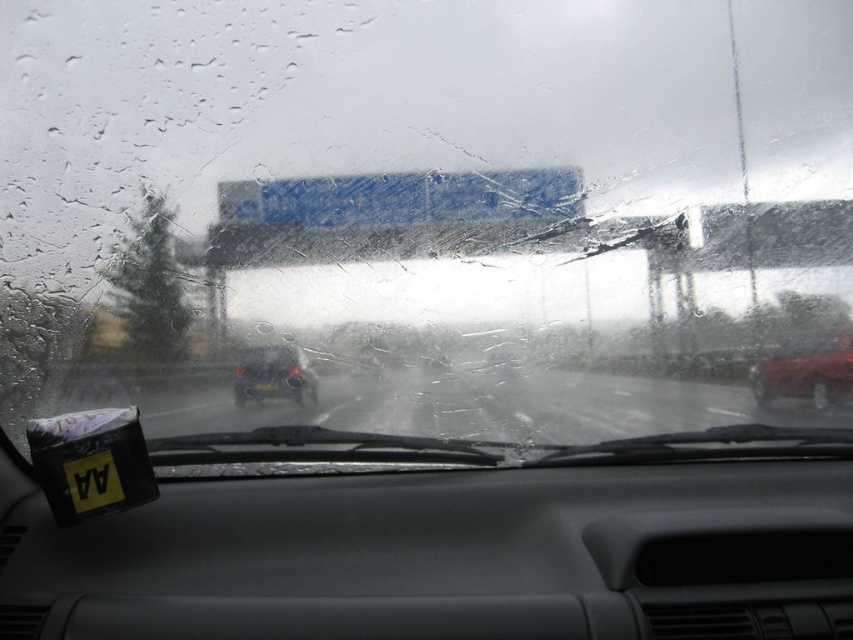
Can you confirm if black matte license plate at lower left is thinner than black plastic license plate at center?

In fact, black matte license plate at lower left might be wider than black plastic license plate at center.

Does black matte license plate at lower left come in front of black plastic license plate at center?

Yes, black matte license plate at lower left is closer to the viewer.

Is point (108, 502) behind point (265, 381)?

No, (108, 502) is closer to viewer.

At what (x,y) coordinates should I click in order to perform the action: click on black matte license plate at lower left. Please return your answer as a coordinate pair (x, y). This screenshot has height=640, width=853. Looking at the image, I should click on pos(93,481).

Can you confirm if transparent wet glass at center is bigger than matte black car at center?

Correct, transparent wet glass at center is larger in size than matte black car at center.

Is transparent wet glass at center below matte black car at center?

Incorrect, transparent wet glass at center is not positioned below matte black car at center.

This screenshot has width=853, height=640. In order to click on transparent wet glass at center in this screenshot , I will do `click(416, 205)`.

At what (x,y) coordinates should I click in order to perform the action: click on transparent wet glass at center. Please return your answer as a coordinate pair (x, y). Image resolution: width=853 pixels, height=640 pixels. Looking at the image, I should click on (416, 205).

Between shiny red sedan at right and matte black car at center, which one has more height?

shiny red sedan at right is taller.

Between shiny red sedan at right and matte black car at center, which one is positioned lower?

Positioned lower is shiny red sedan at right.

Locate an element on the screen. This screenshot has width=853, height=640. shiny red sedan at right is located at coordinates (805, 371).

In order to click on shiny red sedan at right in this screenshot , I will do `click(805, 371)`.